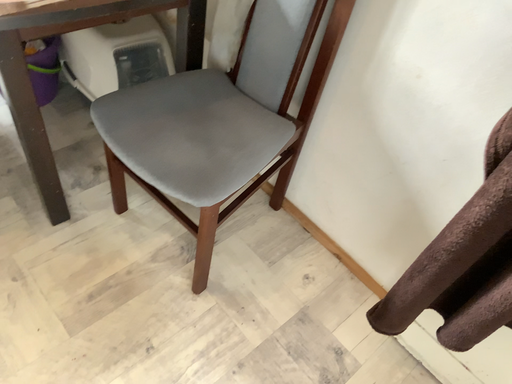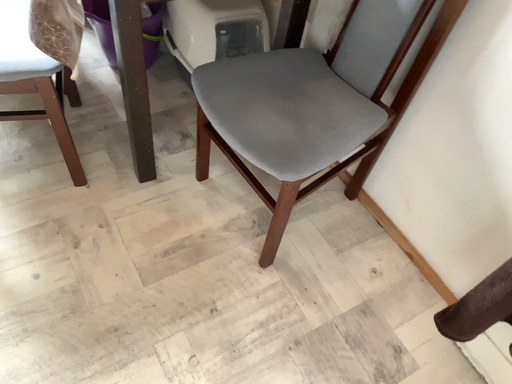
Question: Which way did the camera rotate in the video?

Choices:
 (A) rotated left
 (B) rotated right

Answer: (A)